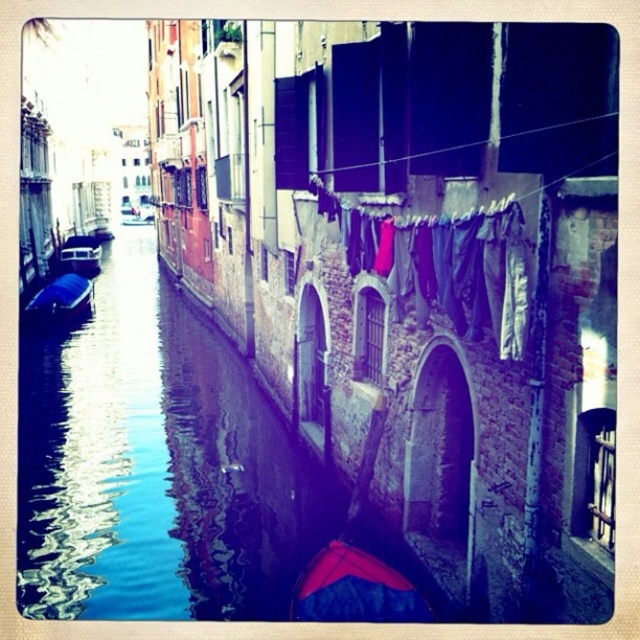
Does point (428, 266) lie behind point (320, 556)?

No.

Who is more forward, (488, 253) or (298, 586)?

Positioned in front is point (488, 253).

Describe the element at coordinates (444, 262) in the screenshot. The image size is (640, 640). I see `multicolored fabric at center` at that location.

In order to click on multicolored fabric at center in this screenshot , I will do `click(444, 262)`.

Is red fabric boat at lower center further to the viewer compared to matte black boat at left?

No, it is in front of matte black boat at left.

Does point (324, 588) come farther from viewer compared to point (88, 252)?

No, (324, 588) is in front of (88, 252).

Find the location of a particular element. This screenshot has width=640, height=640. red fabric boat at lower center is located at coordinates (355, 589).

Who is higher up, blue fabric boat at left or matte black boat at left?

Positioned higher is matte black boat at left.

Between point (60, 305) and point (67, 244), which one is positioned behind?

Positioned behind is point (67, 244).

Describe the element at coordinates (60, 300) in the screenshot. I see `blue fabric boat at left` at that location.

At what (x,y) coordinates should I click in order to perform the action: click on blue fabric boat at left. Please return your answer as a coordinate pair (x, y). Looking at the image, I should click on (60, 300).